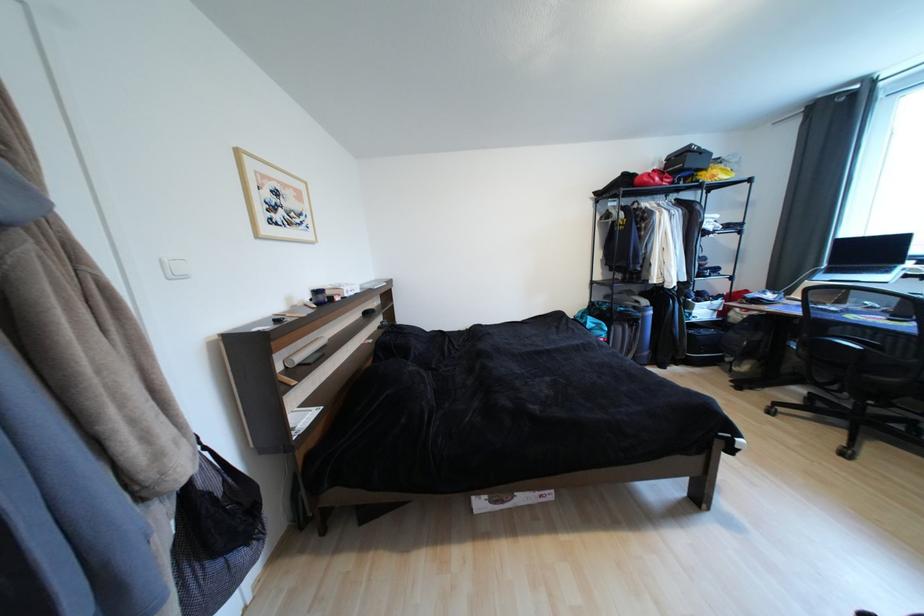
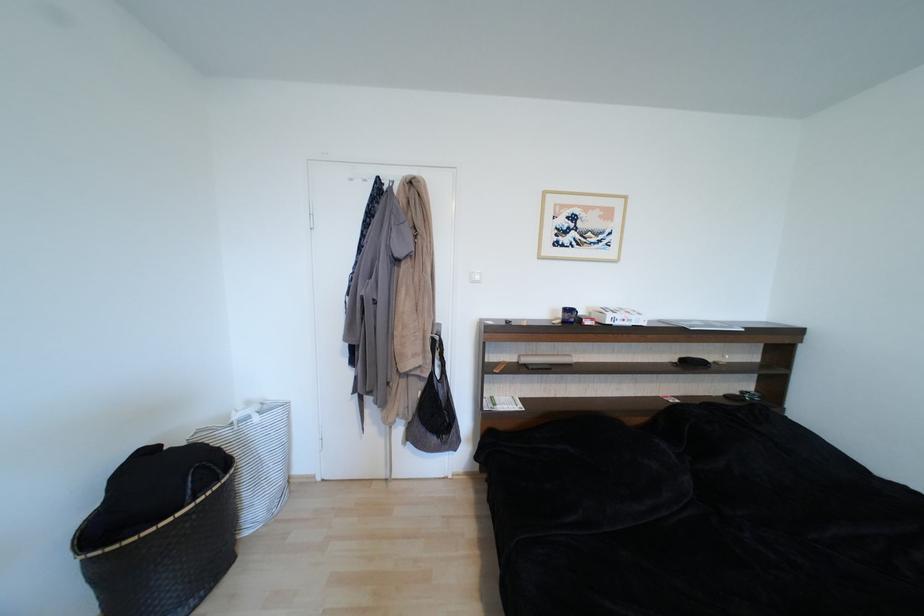
Question: Based on the continuous images, in which direction is the camera rotating? Reply with the corresponding letter.

Choices:
 (A) Left
 (B) Right
 (C) Up
 (D) Down

Answer: (A)